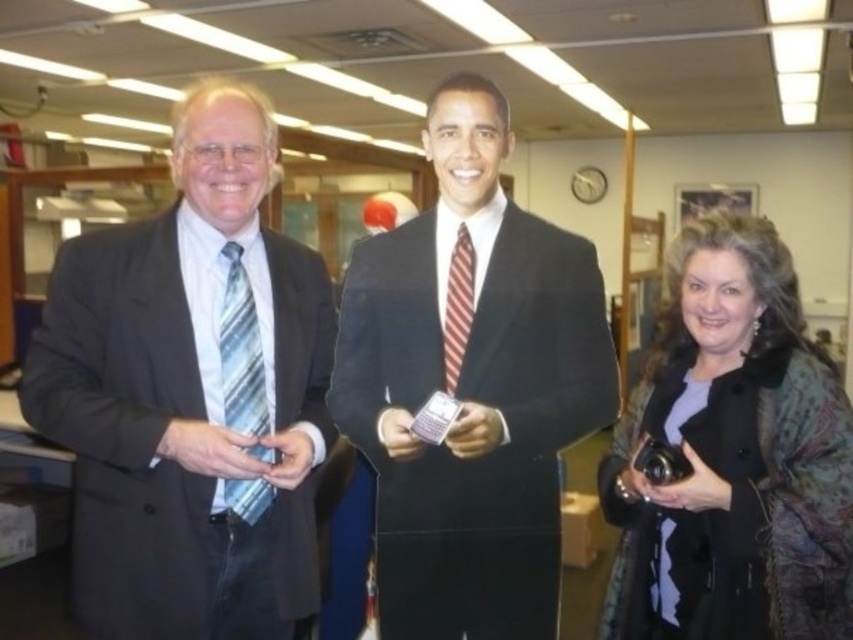
Question: Which of the following is the closest to the observer?

Choices:
 (A) (80, 300)
 (B) (846, 464)
 (C) (402, 628)

Answer: (B)

Question: Is matte black suit at left above black textured coat at lower right?

Choices:
 (A) no
 (B) yes

Answer: (B)

Question: Estimate the real-world distances between objects in this image. Which object is closer to the black textured coat at lower right?

Choices:
 (A) black velvet suit at center
 (B) matte black suit at left

Answer: (A)

Question: Can you confirm if matte black suit at left is positioned above black velvet suit at center?

Choices:
 (A) yes
 (B) no

Answer: (A)

Question: Can you confirm if black velvet suit at center is wider than black textured coat at lower right?

Choices:
 (A) no
 (B) yes

Answer: (B)

Question: Considering the real-world distances, which object is closest to the black velvet suit at center?

Choices:
 (A) black textured coat at lower right
 (B) matte black suit at left

Answer: (B)